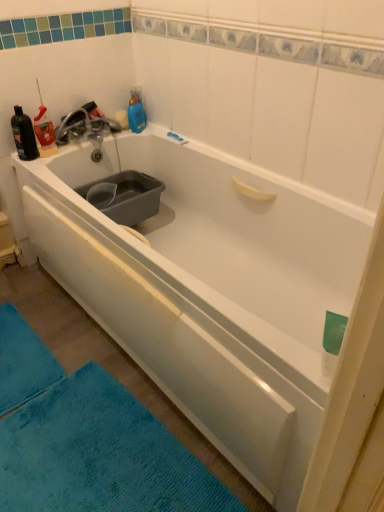
Question: Is blue soft bath mat at lower left wider or thinner than black matte bottle at upper left?

Choices:
 (A) thin
 (B) wide

Answer: (B)

Question: Is point (13, 403) positioned closer to the camera than point (29, 137)?

Choices:
 (A) closer
 (B) farther

Answer: (A)

Question: Which object is the farthest from the blue soft bath mat at lower left?

Choices:
 (A) black matte bottle at upper left
 (B) matte silver faucet at upper left

Answer: (B)

Question: Which object is the farthest from the black matte bottle at upper left?

Choices:
 (A) matte silver faucet at upper left
 (B) blue soft bath mat at lower left

Answer: (B)